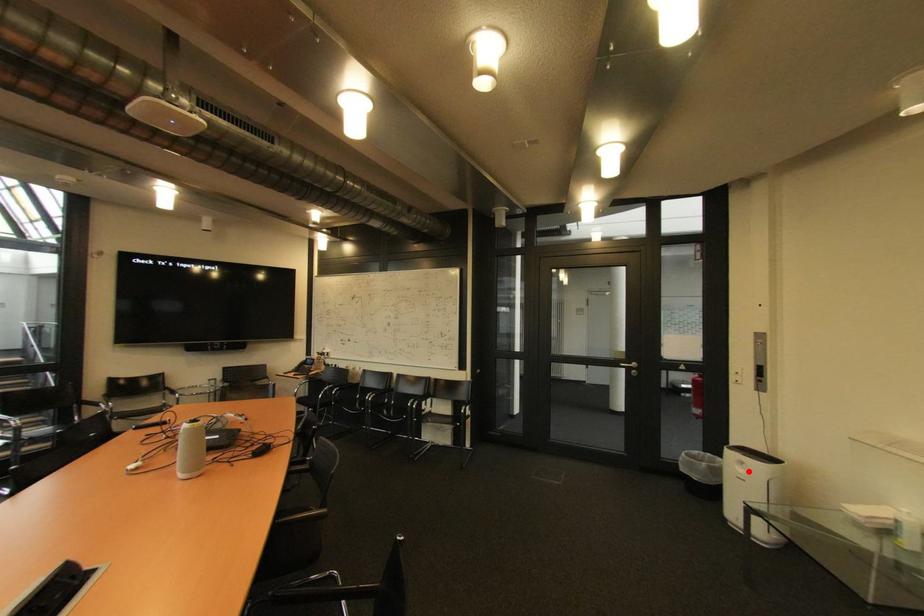
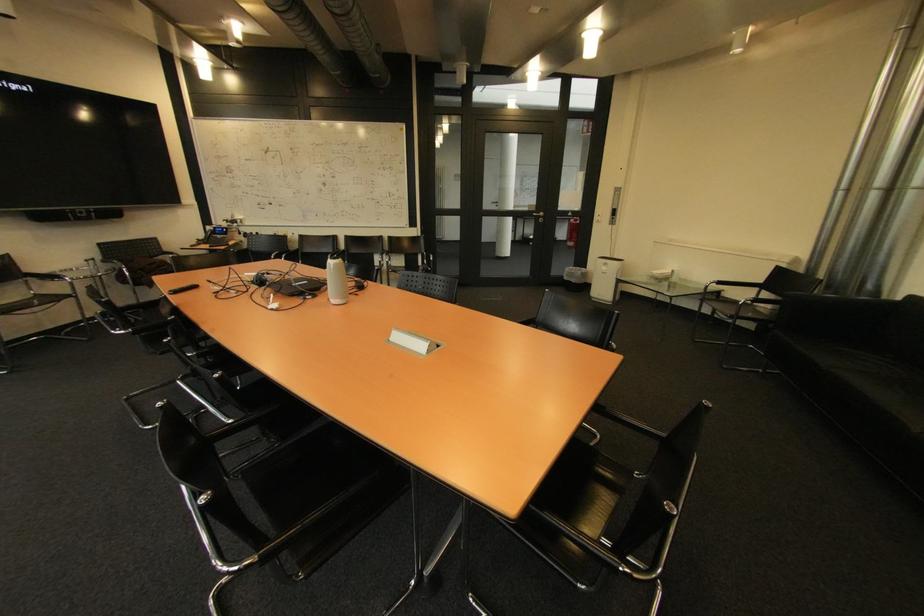
Question: I am providing you with two images of the same scene from different viewpoints. Given a red point in image1, look at the same physical point in image2. Is it:

Choices:
 (A) Closer to the viewpoint
 (B) Farther from the viewpoint

Answer: (A)